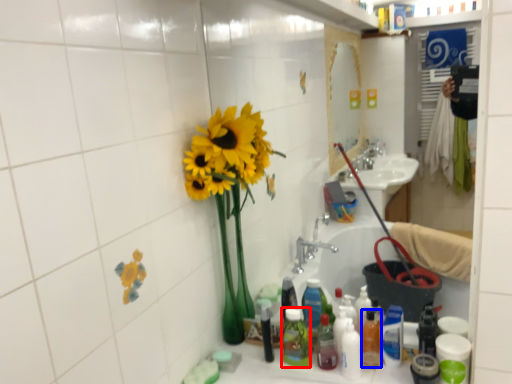
Question: Among these objects, which one is nearest to the camera, toiletry (highlighted by a red box) or bottle (highlighted by a blue box)?

Choices:
 (A) toiletry
 (B) bottle

Answer: (B)